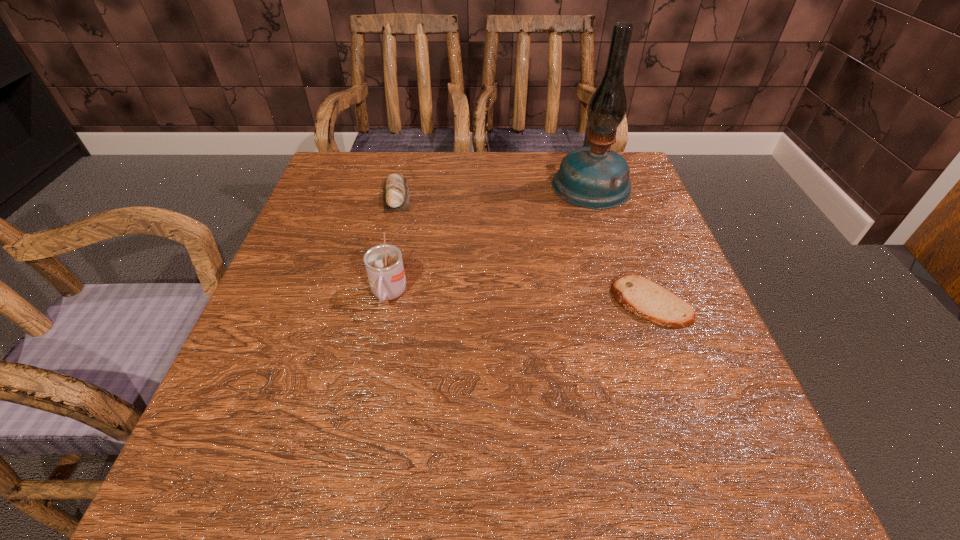
Find the location of a particular element. free space between the shorter pita bread and the tallest object is located at coordinates (621, 244).

I want to click on empty location between the oil lamp and the cup, so click(x=490, y=240).

Choose which object is the nearest neighbor to the cup. Please provide its 2D coordinates. Your answer should be formatted as a tuple, i.e. [(x, y)], where the tuple contains the x and y coordinates of a point satisfying the conditions above.

[(395, 189)]

Where is `the second closest object to the oil lamp`? the second closest object to the oil lamp is located at coordinates (395, 189).

This screenshot has height=540, width=960. I want to click on blank area in the image that satisfies the following two spatial constraints: 1. on the back side of the oil lamp; 2. on the left side of the third tallest object, so click(x=398, y=185).

Image resolution: width=960 pixels, height=540 pixels. Identify the location of free space in the image that satisfies the following two spatial constraints: 1. on the side with the handle of the right pita bread; 2. on the left side of the third shortest object. (387, 303).

You are a GUI agent. You are given a task and a screenshot of the screen. Output one action in this format:
    pyautogui.click(x=<x>, y=<y>)
    Task: Click on the vacant point that satisfies the following two spatial constraints: 1. on the back side of the left pita bread; 2. on the right side of the oil lamp
    This screenshot has width=960, height=540.
    Given the screenshot: What is the action you would take?
    pyautogui.click(x=398, y=185)

Locate an element on the screen. The image size is (960, 540). free space that satisfies the following two spatial constraints: 1. on the side with the handle of the cup; 2. on the left side of the nearer pita bread is located at coordinates (387, 303).